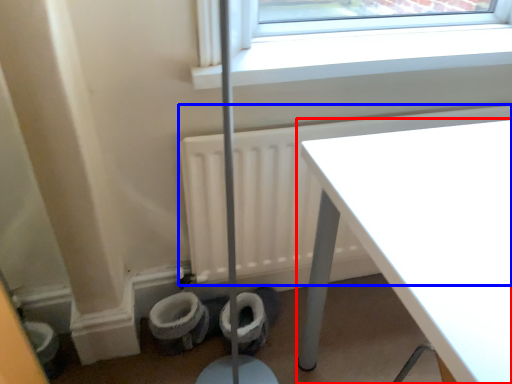
Question: Which object appears closest to the camera in this image, table (highlighted by a red box) or radiator (highlighted by a blue box)?

Choices:
 (A) table
 (B) radiator

Answer: (A)